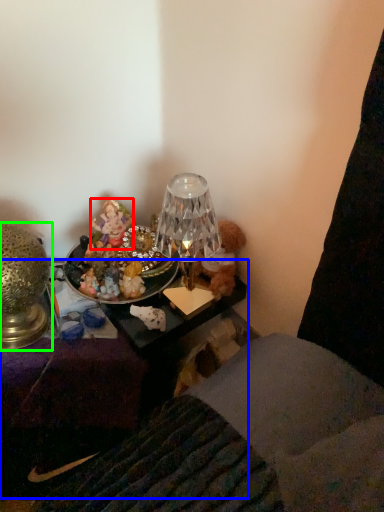
Question: Which is farther away from person (highlighted by a red box)? furniture (highlighted by a blue box) or lamp (highlighted by a green box)?

Choices:
 (A) furniture
 (B) lamp

Answer: (A)